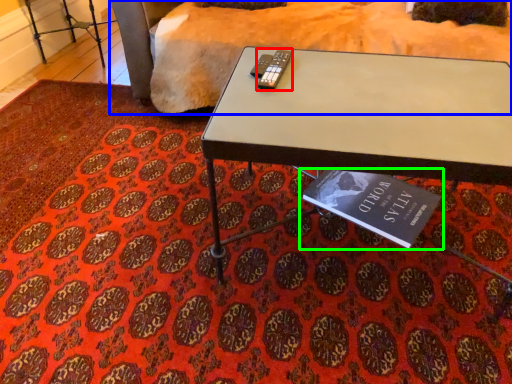
Question: Considering the real-world distances, which object is closest to remote (highlighted by a red box)? bedding (highlighted by a blue box) or book (highlighted by a green box).

Choices:
 (A) bedding
 (B) book

Answer: (B)